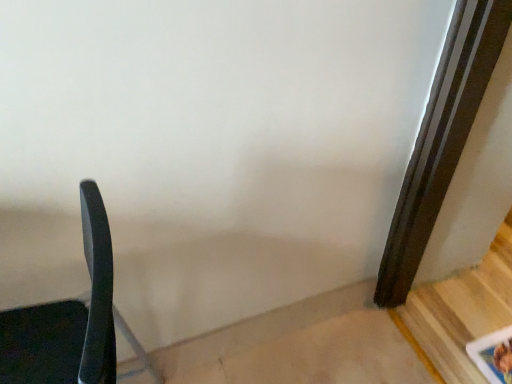
What do you see at coordinates (71, 320) in the screenshot? The image size is (512, 384). I see `matte black chair at left` at bounding box center [71, 320].

Measure the distance between point [80,356] and camera.

Point [80,356] is 26.81 inches away from camera.

Identify the location of matte black chair at left. The height and width of the screenshot is (384, 512). (71, 320).

In order to click on matte black chair at left in this screenshot , I will do [71, 320].